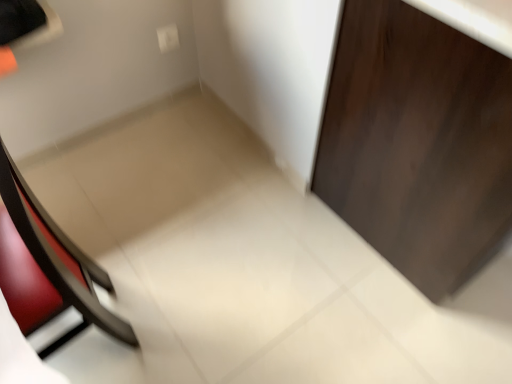
Describe the element at coordinates (58, 254) in the screenshot. This screenshot has height=384, width=512. I see `matte black chair at left` at that location.

What is the approximate height of dark wood door at right?

It is 33.80 inches.

The height and width of the screenshot is (384, 512). I want to click on dark wood door at right, so click(417, 143).

You are a GUI agent. You are given a task and a screenshot of the screen. Output one action in this format:
    pyautogui.click(x=<x>, y=<y>)
    Task: Click on the matte black chair at left
    The image size is (512, 384).
    Given the screenshot: What is the action you would take?
    pyautogui.click(x=58, y=254)

How different are the orientations of white plastic electric outlet at upper center and dark wood door at right in degrees?

1.37 degrees separate the facing orientations of white plastic electric outlet at upper center and dark wood door at right.

Between white plastic electric outlet at upper center and dark wood door at right, which one is positioned behind?

white plastic electric outlet at upper center is further away from the camera.

From a real-world perspective, relative to dark wood door at right, is white plastic electric outlet at upper center vertically above or below?

white plastic electric outlet at upper center is below dark wood door at right.

From their relative heights in the image, would you say white plastic electric outlet at upper center is taller or shorter than dark wood door at right?

In the image, white plastic electric outlet at upper center appears to be shorter than dark wood door at right.

Consider the image. Considering the sizes of objects white plastic electric outlet at upper center and matte black chair at left in the image provided, who is wider, white plastic electric outlet at upper center or matte black chair at left?

matte black chair at left.

In the scene shown: Between white plastic electric outlet at upper center and matte black chair at left, which one has smaller size?

white plastic electric outlet at upper center.

Would you say white plastic electric outlet at upper center is a long distance from matte black chair at left?

white plastic electric outlet at upper center is near matte black chair at left, not far away.

Is dark wood door at right shorter than white plastic electric outlet at upper center?

No.

Would you consider dark wood door at right to be distant from white plastic electric outlet at upper center?

That's right, there is a large distance between dark wood door at right and white plastic electric outlet at upper center.

In the scene shown: Between dark wood door at right and white plastic electric outlet at upper center, which one is positioned behind?

white plastic electric outlet at upper center is further away from the camera.

Image resolution: width=512 pixels, height=384 pixels. Identify the location of electric outlet lying on the left of dark wood door at right. (168, 38).

Considering the relative positions of dark wood door at right and matte black chair at left in the image provided, is dark wood door at right to the left of matte black chair at left from the viewer's perspective?

No, dark wood door at right is not to the left of matte black chair at left.

Could you tell me if dark wood door at right is turned towards matte black chair at left?

No.

Is dark wood door at right taller or shorter than matte black chair at left?

dark wood door at right is shorter than matte black chair at left.

How distant is dark wood door at right from matte black chair at left?

dark wood door at right is 83.10 centimeters away from matte black chair at left.

Is white plastic electric outlet at upper center completely or partially inside matte black chair at left?

No, white plastic electric outlet at upper center is not a part of matte black chair at left.

In the scene shown: Can you confirm if matte black chair at left is positioned to the left of white plastic electric outlet at upper center?

Indeed, matte black chair at left is positioned on the left side of white plastic electric outlet at upper center.

In the image, is matte black chair at left positioned in front of or behind white plastic electric outlet at upper center?

Clearly, matte black chair at left is in front of white plastic electric outlet at upper center.

The width and height of the screenshot is (512, 384). What are the coordinates of `electric outlet behind the matte black chair at left` in the screenshot? It's located at click(168, 38).

Considering the sizes of objects matte black chair at left and dark wood door at right in the image provided, who is smaller, matte black chair at left or dark wood door at right?

matte black chair at left is smaller.

Is the depth of matte black chair at left greater than that of dark wood door at right?

No, matte black chair at left is closer to the camera.

From the image's perspective, is matte black chair at left located above or below dark wood door at right?

matte black chair at left is situated lower than dark wood door at right in the image.

You are a GUI agent. You are given a task and a screenshot of the screen. Output one action in this format:
    pyautogui.click(x=<x>, y=<y>)
    Task: Click on the electric outlet that is behind the dark wood door at right
    
    Given the screenshot: What is the action you would take?
    pyautogui.click(x=168, y=38)

This screenshot has width=512, height=384. Find the location of `electric outlet that appears on the right of matte black chair at left`. electric outlet that appears on the right of matte black chair at left is located at coordinates (168, 38).

Looking at the image, which one is located further to matte black chair at left, dark wood door at right or white plastic electric outlet at upper center?

white plastic electric outlet at upper center is further to matte black chair at left.

Looking at this image, looking at the image, which one is located further to dark wood door at right, white plastic electric outlet at upper center or matte black chair at left?

white plastic electric outlet at upper center is further to dark wood door at right.

Which object lies further to the anchor point dark wood door at right, matte black chair at left or white plastic electric outlet at upper center?

white plastic electric outlet at upper center is further to dark wood door at right.

From the image, which object appears to be farther from white plastic electric outlet at upper center, dark wood door at right or matte black chair at left?

dark wood door at right.

When comparing their distances from white plastic electric outlet at upper center, does matte black chair at left or dark wood door at right seem closer?

matte black chair at left.

Which object lies nearer to the anchor point matte black chair at left, white plastic electric outlet at upper center or dark wood door at right?

dark wood door at right lies closer to matte black chair at left than the other object.

Image resolution: width=512 pixels, height=384 pixels. In order to click on electric outlet located between matte black chair at left and dark wood door at right in the left-right direction in this screenshot , I will do `click(168, 38)`.